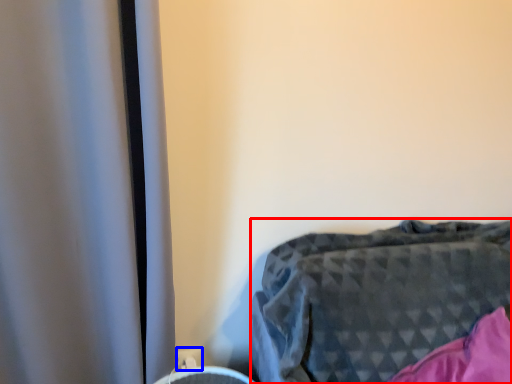
Question: Which point is further to the camera, furniture (highlighted by a red box) or electric outlet (highlighted by a blue box)?

Choices:
 (A) furniture
 (B) electric outlet

Answer: (B)